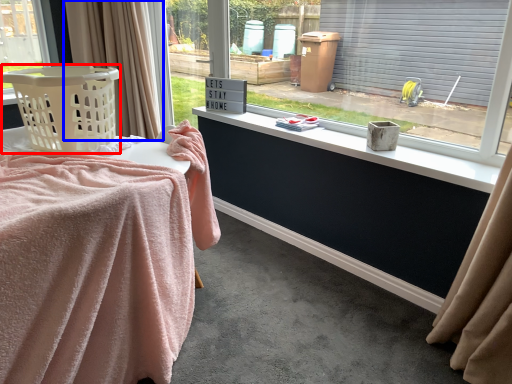
Question: Which of the following is the closest to the observer, basket (highlighted by a red box) or curtain (highlighted by a blue box)?

Choices:
 (A) basket
 (B) curtain

Answer: (A)